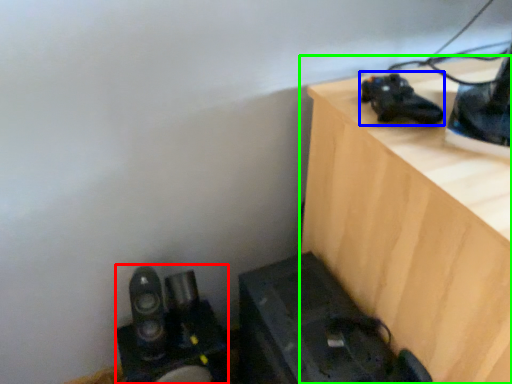
Question: Which is nearer to the equipment (highlighted by a red box)? shoe (highlighted by a blue box) or furniture (highlighted by a green box).

Choices:
 (A) shoe
 (B) furniture

Answer: (B)